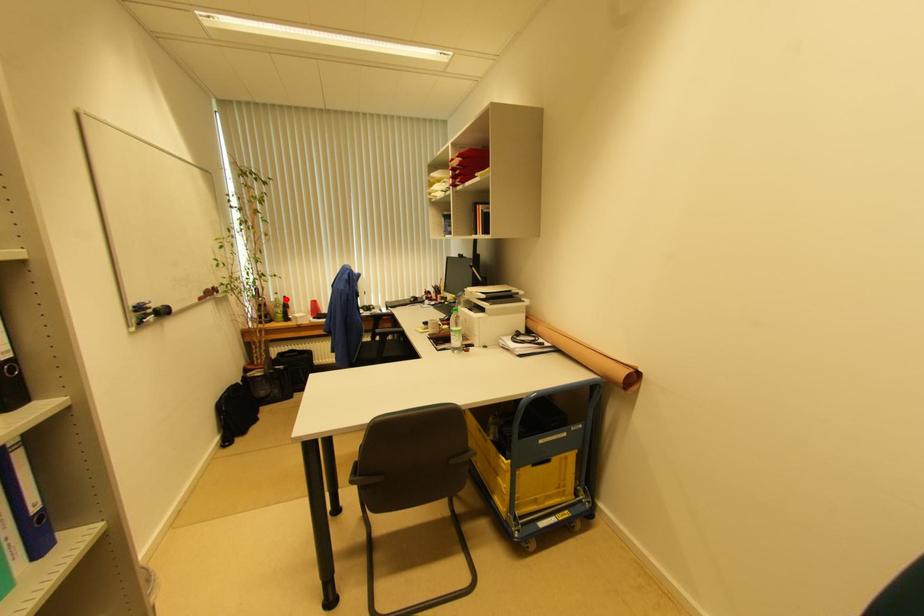
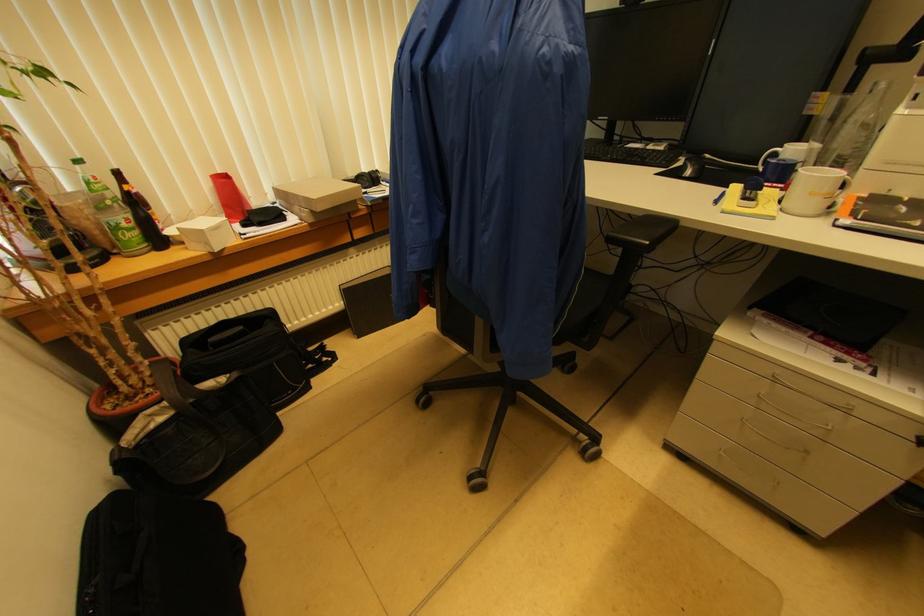
Locate, in the second image, the point that corresponds to the highlighted location in the first image.

(118, 176)